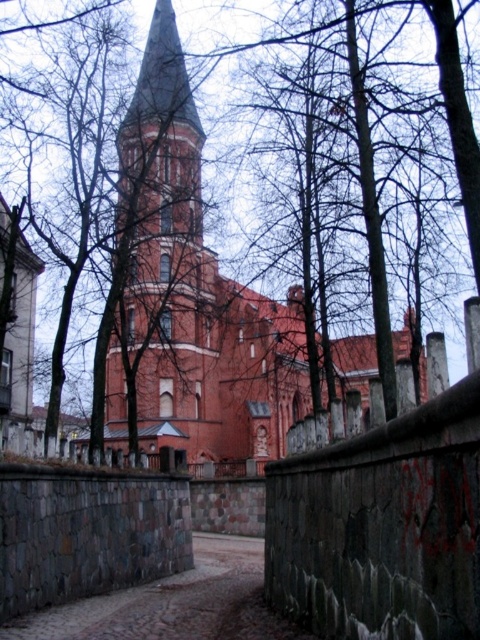
Between red brick church at center and weathered stone wall at center, which one appears on the right side from the viewer's perspective?

weathered stone wall at center

Who is taller, red brick church at center or weathered stone wall at center?

Standing taller between the two is red brick church at center.

Between point (107, 372) and point (345, 592), which one is positioned in front?

Positioned in front is point (345, 592).

You are a GUI agent. You are given a task and a screenshot of the screen. Output one action in this format:
    pyautogui.click(x=<x>, y=<y>)
    Task: Click on the red brick church at center
    This screenshot has width=480, height=640.
    Given the screenshot: What is the action you would take?
    pyautogui.click(x=197, y=292)